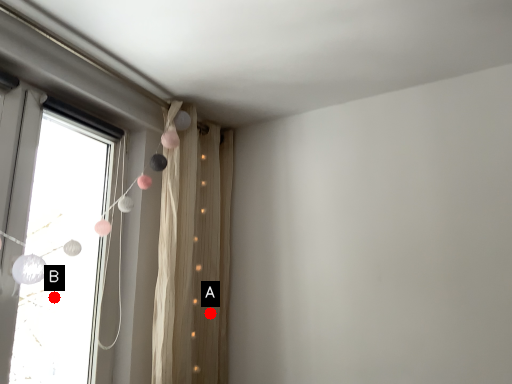
Question: Two points are circled on the image, labeled by A and B beside each circle. Which point is farther from the camera taking this photo?

Choices:
 (A) A is further
 (B) B is further

Answer: (A)